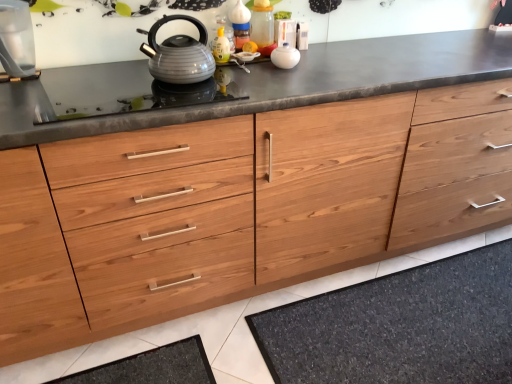
What do you see at coordinates (179, 54) in the screenshot? I see `matte gray kettle at center` at bounding box center [179, 54].

Identify the location of white glossy bowl at upper center, which is counted as the first appliance, starting from the right. click(285, 56).

The width and height of the screenshot is (512, 384). What do you see at coordinates (122, 91) in the screenshot? I see `black glass gas stove at center` at bounding box center [122, 91].

Find the location of a particular element. The width and height of the screenshot is (512, 384). matte gray kettle at center is located at coordinates (179, 54).

Is point (154, 51) closer or farther from the camera than point (6, 32)?

Point (154, 51).

In the scene shown: Considering the sizes of matte gray kettle at center and transparent glass water at left, the first appliance positioned from the left, in the image, is matte gray kettle at center wider or thinner than transparent glass water at left, the first appliance positioned from the left,?

Considering their sizes, matte gray kettle at center looks broader than transparent glass water at left, the first appliance positioned from the left.

Based on the photo, could transparent glass water at left, the first appliance positioned from the left, be considered to be inside matte gray kettle at center?

No, transparent glass water at left, the first appliance positioned from the left, is not a part of matte gray kettle at center.

From a real-world perspective, which is physically above, matte gray kettle at center or transparent glass water at left, the second appliance in the right-to-left sequence?

transparent glass water at left, the second appliance in the right-to-left sequence, from a real-world perspective.

Is white glossy bowl at upper center, the second appliance in the left-to-right sequence, at the left side of black glass gas stove at center?

In fact, white glossy bowl at upper center, the second appliance in the left-to-right sequence, is to the right of black glass gas stove at center.

How distant is white glossy bowl at upper center, the second appliance in the left-to-right sequence, from black glass gas stove at center?

A distance of 16.45 inches exists between white glossy bowl at upper center, the second appliance in the left-to-right sequence, and black glass gas stove at center.

Can you confirm if white glossy bowl at upper center, which is counted as the first appliance, starting from the right, is thinner than black glass gas stove at center?

Yes.

Is point (276, 66) positioned in front of point (87, 70)?

Yes.

Between matte gray kettle at center and white glossy bowl at upper center, which is counted as the first appliance, starting from the right, which one has smaller size?

white glossy bowl at upper center, which is counted as the first appliance, starting from the right.

From a real-world perspective, does matte gray kettle at center sit lower than white glossy bowl at upper center, which is counted as the first appliance, starting from the right?

Actually, matte gray kettle at center is physically above white glossy bowl at upper center, which is counted as the first appliance, starting from the right, in the real world.

From the image's perspective, is matte gray kettle at center located beneath white glossy bowl at upper center, which is counted as the first appliance, starting from the right?

Indeed, from the image's perspective, matte gray kettle at center is shown beneath white glossy bowl at upper center, which is counted as the first appliance, starting from the right.

Is matte gray kettle at center thinner than white glossy bowl at upper center, which is counted as the first appliance, starting from the right?

No, matte gray kettle at center is not thinner than white glossy bowl at upper center, which is counted as the first appliance, starting from the right.

From a real-world perspective, which object stands above the other?

black glass gas stove at center, from a real-world perspective.

Does black glass gas stove at center contain dark gray textured bath mat at lower center?

No, dark gray textured bath mat at lower center is not inside black glass gas stove at center.

Is black glass gas stove at center taller than dark gray textured bath mat at lower center?

Incorrect, the height of black glass gas stove at center is not larger of that of dark gray textured bath mat at lower center.

Is black glass gas stove at center at the right side of dark gray textured bath mat at lower center?

No, black glass gas stove at center is not to the right of dark gray textured bath mat at lower center.

Considering the relative positions of matte gray kettle at center and dark gray textured bath mat at lower center in the image provided, is matte gray kettle at center to the right of dark gray textured bath mat at lower center from the viewer's perspective?

Incorrect, matte gray kettle at center is not on the right side of dark gray textured bath mat at lower center.

Is matte gray kettle at center taller than dark gray textured bath mat at lower center?

Indeed, matte gray kettle at center has a greater height compared to dark gray textured bath mat at lower center.

From a real-world perspective, which object stands above the other?

matte gray kettle at center, from a real-world perspective.

Relative to dark gray textured bath mat at lower center, is matte gray kettle at center in front or behind?

Visually, matte gray kettle at center is located in front of dark gray textured bath mat at lower center.

From a real-world perspective, which is physically above, black glass gas stove at center or white glossy bowl at upper center, which is counted as the first appliance, starting from the right?

white glossy bowl at upper center, which is counted as the first appliance, starting from the right, is physically above.

Find the location of a particular element. appliance that is the 2nd object located above the black glass gas stove at center (from the image's perspective) is located at coordinates (285, 56).

From the image's perspective, which is above, black glass gas stove at center or white glossy bowl at upper center, which is counted as the first appliance, starting from the right?

white glossy bowl at upper center, which is counted as the first appliance, starting from the right, from the image's perspective.

Where is `bath mat on the right of transparent glass water at left, the second appliance in the right-to-left sequence`? bath mat on the right of transparent glass water at left, the second appliance in the right-to-left sequence is located at coordinates (399, 326).

Is point (490, 268) closer or farther from the camera than point (18, 69)?

Point (490, 268) is farther from the camera than point (18, 69).

Is dark gray textured bath mat at lower center looking in the opposite direction of transparent glass water at left, the first appliance positioned from the left?

No, dark gray textured bath mat at lower center is not facing the opposite direction of transparent glass water at left, the first appliance positioned from the left.

Looking at this image, from the image's perspective, between dark gray textured bath mat at lower center and transparent glass water at left, the first appliance positioned from the left, which one is located above?

transparent glass water at left, the first appliance positioned from the left, appears higher in the image.

Where is `appliance that is on the left side of matte gray kettle at center`? appliance that is on the left side of matte gray kettle at center is located at coordinates (16, 39).

Locate an element on the screen. This screenshot has width=512, height=384. gas stove located in front of the white glossy bowl at upper center, the second appliance in the left-to-right sequence is located at coordinates (122, 91).

Estimate the real-world distances between objects in this image. Which object is further from matte gray kettle at center, white glossy bowl at upper center, the second appliance in the left-to-right sequence, or dark gray textured bath mat at lower center?

The object further to matte gray kettle at center is dark gray textured bath mat at lower center.

Which object lies further to the anchor point matte gray kettle at center, white glossy bowl at upper center, the second appliance in the left-to-right sequence, or black glass gas stove at center?

white glossy bowl at upper center, the second appliance in the left-to-right sequence.

Which object lies further to the anchor point black glass gas stove at center, transparent glass water at left, the second appliance in the right-to-left sequence, or matte gray kettle at center?

transparent glass water at left, the second appliance in the right-to-left sequence, lies further to black glass gas stove at center than the other object.

Estimate the real-world distances between objects in this image. Which object is closer to matte gray kettle at center, white glossy bowl at upper center, the second appliance in the left-to-right sequence, or transparent glass water at left, the first appliance positioned from the left?

Based on the image, white glossy bowl at upper center, the second appliance in the left-to-right sequence, appears to be nearer to matte gray kettle at center.

Consider the image. When comparing their distances from dark gray textured bath mat at lower center, does white glossy bowl at upper center, the second appliance in the left-to-right sequence, or matte gray kettle at center seem closer?

Among the two, white glossy bowl at upper center, the second appliance in the left-to-right sequence, is located nearer to dark gray textured bath mat at lower center.

Based on their spatial positions, is black glass gas stove at center or transparent glass water at left, the second appliance in the right-to-left sequence, further from matte gray kettle at center?

transparent glass water at left, the second appliance in the right-to-left sequence, is further to matte gray kettle at center.

Which object lies nearer to the anchor point dark gray textured bath mat at lower center, transparent glass water at left, the second appliance in the right-to-left sequence, or black glass gas stove at center?

Among the two, black glass gas stove at center is located nearer to dark gray textured bath mat at lower center.

Looking at the image, which one is located closer to matte gray kettle at center, transparent glass water at left, the first appliance positioned from the left, or black glass gas stove at center?

black glass gas stove at center lies closer to matte gray kettle at center than the other object.

Where is `gas stove between transparent glass water at left, the second appliance in the right-to-left sequence, and matte gray kettle at center, in the horizontal direction`? This screenshot has height=384, width=512. gas stove between transparent glass water at left, the second appliance in the right-to-left sequence, and matte gray kettle at center, in the horizontal direction is located at coordinates (122, 91).

Locate an element on the screen. The image size is (512, 384). appliance located between black glass gas stove at center and dark gray textured bath mat at lower center in the left-right direction is located at coordinates (285, 56).

Identify the location of gas stove located between transparent glass water at left, the second appliance in the right-to-left sequence, and dark gray textured bath mat at lower center in the left-right direction. (122, 91).

Find the location of a particular element. gas stove between transparent glass water at left, the first appliance positioned from the left, and white glossy bowl at upper center, which is counted as the first appliance, starting from the right is located at coordinates (122, 91).